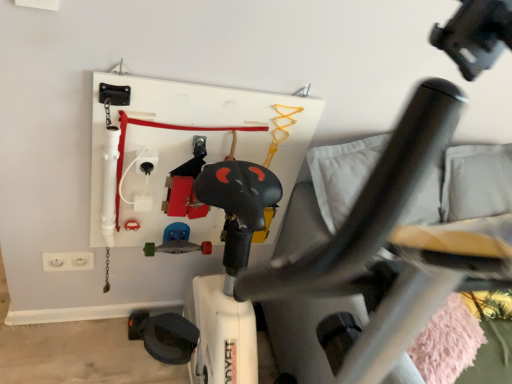
Question: Considering the relative sizes of metallic silver skateboard at center and black plastic swivel chair at center in the image provided, is metallic silver skateboard at center wider than black plastic swivel chair at center?

Choices:
 (A) yes
 (B) no

Answer: (B)

Question: Would you say metallic silver skateboard at center is outside black plastic swivel chair at center?

Choices:
 (A) yes
 (B) no

Answer: (B)

Question: From the image's perspective, is metallic silver skateboard at center above black plastic swivel chair at center?

Choices:
 (A) no
 (B) yes

Answer: (B)

Question: Considering the relative sizes of metallic silver skateboard at center and black plastic swivel chair at center in the image provided, is metallic silver skateboard at center shorter than black plastic swivel chair at center?

Choices:
 (A) no
 (B) yes

Answer: (B)

Question: Considering the relative sizes of metallic silver skateboard at center and black plastic swivel chair at center in the image provided, is metallic silver skateboard at center smaller than black plastic swivel chair at center?

Choices:
 (A) no
 (B) yes

Answer: (B)

Question: Looking at the image, does white plastic electrical outlet at lower left seem bigger or smaller compared to black plastic swivel chair at center?

Choices:
 (A) small
 (B) big

Answer: (A)

Question: Is white plastic electrical outlet at lower left inside the boundaries of black plastic swivel chair at center, or outside?

Choices:
 (A) outside
 (B) inside

Answer: (A)

Question: Considering their positions, is white plastic electrical outlet at lower left located in front of or behind black plastic swivel chair at center?

Choices:
 (A) front
 (B) behind

Answer: (B)

Question: Is white plastic electrical outlet at lower left taller or shorter than black plastic swivel chair at center?

Choices:
 (A) tall
 (B) short

Answer: (B)

Question: Choose the correct answer: Is metallic silver skateboard at center inside white plastic electrical outlet at lower left or outside it?

Choices:
 (A) inside
 (B) outside

Answer: (B)

Question: Is metallic silver skateboard at center wider or thinner than white plastic electrical outlet at lower left?

Choices:
 (A) thin
 (B) wide

Answer: (B)

Question: Considering their positions, is metallic silver skateboard at center located in front of or behind white plastic electrical outlet at lower left?

Choices:
 (A) front
 (B) behind

Answer: (A)

Question: From the image's perspective, is metallic silver skateboard at center positioned above or below white plastic electrical outlet at lower left?

Choices:
 (A) below
 (B) above

Answer: (B)

Question: From a real-world perspective, is black plastic swivel chair at center positioned above or below metallic silver skateboard at center?

Choices:
 (A) below
 (B) above

Answer: (B)

Question: Would you say black plastic swivel chair at center is to the left or to the right of metallic silver skateboard at center in the picture?

Choices:
 (A) left
 (B) right

Answer: (B)